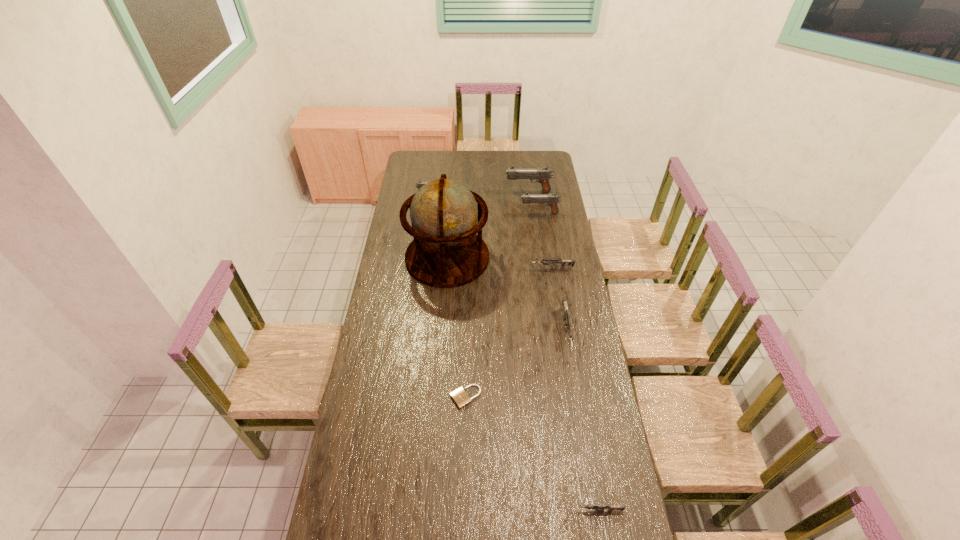
Locate an element on the screen. This screenshot has height=540, width=960. the second closest gray gun to the fifth tallest object is located at coordinates (543, 175).

This screenshot has height=540, width=960. In order to click on grey gun that is the closest to the fifth tallest object in this screenshot , I will do `click(545, 262)`.

The image size is (960, 540). I want to click on the third closest grey gun to the shortest object, so click(545, 262).

Find the location of `free spot that satisfies the following two spatial constraints: 1. in the direction the second farthest gun is aimed; 2. on the back side of the beige padlock`. free spot that satisfies the following two spatial constraints: 1. in the direction the second farthest gun is aimed; 2. on the back side of the beige padlock is located at coordinates (404, 397).

Locate an element on the screen. This screenshot has width=960, height=540. free space that satisfies the following two spatial constraints: 1. in the direction the shortest object is aimed; 2. on the right side of the smallest gray gun is located at coordinates (404, 397).

At what (x,y) coordinates should I click in order to perform the action: click on vacant space that satisfies the following two spatial constraints: 1. in the direction the second smallest gray gun is aimed; 2. on the front-facing side of the globe. Please return your answer as a coordinate pair (x, y). Image resolution: width=960 pixels, height=540 pixels. Looking at the image, I should click on (546, 258).